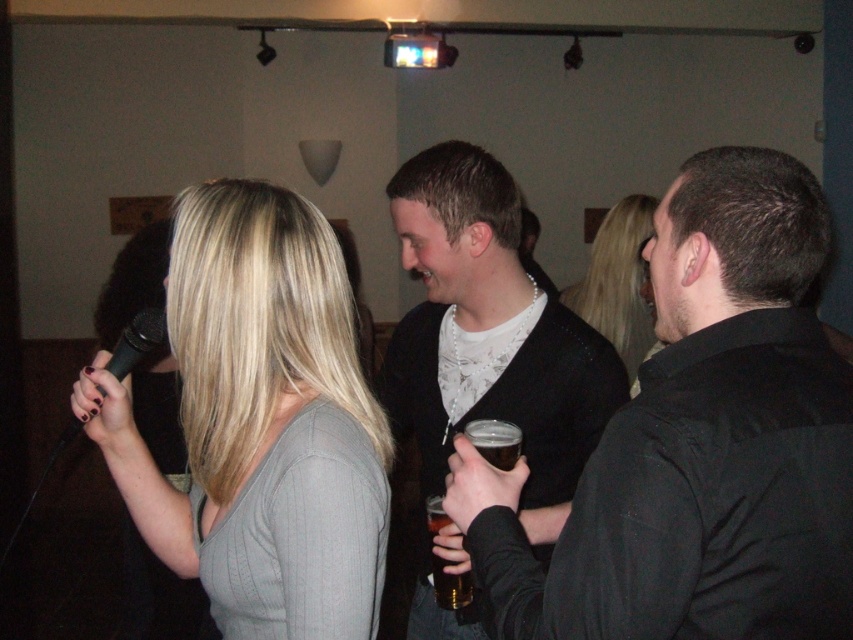
Which is more to the right, blonde hair at center or translucent glass at upper center?

Positioned to the right is blonde hair at center.

Does blonde hair at center lie in front of translucent glass at upper center?

No, it is not.

Is point (634, 392) behind point (515, 426)?

Yes, point (634, 392) is behind point (515, 426).

The image size is (853, 640). What are the coordinates of `blonde hair at center` in the screenshot? It's located at (618, 282).

Is black sweater at center bigger than translucent glass at upper center?

Yes.

Is point (480, 387) behind point (500, 461)?

That is True.

Find the location of a particular element. This screenshot has height=640, width=853. black sweater at center is located at coordinates (489, 337).

Where is `black sweater at center`? This screenshot has height=640, width=853. black sweater at center is located at coordinates (489, 337).

Is point (397, 228) closer to camera compared to point (115, 355)?

That is False.

At what (x,y) coordinates should I click in order to perform the action: click on black sweater at center. Please return your answer as a coordinate pair (x, y). Looking at the image, I should click on (489, 337).